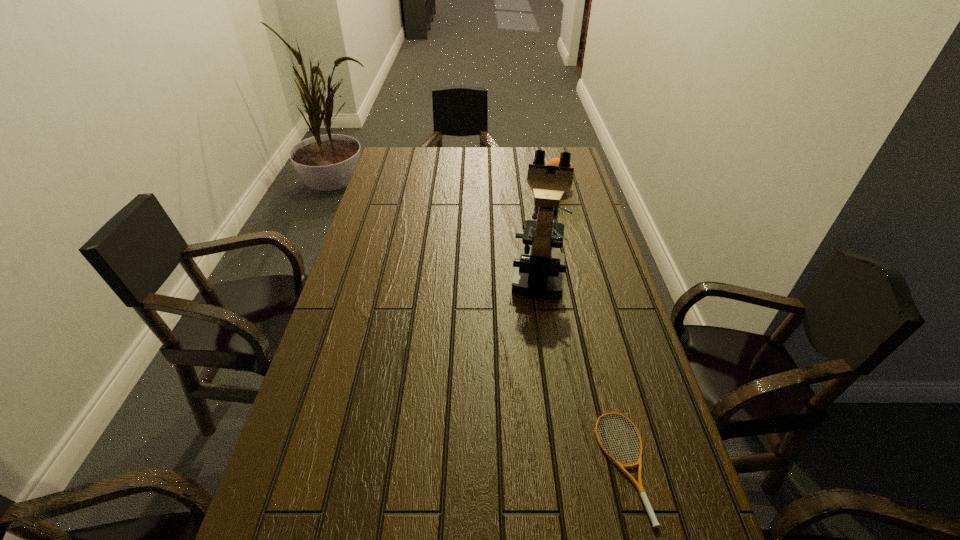
At what (x,y) coordinates should I click in order to perform the action: click on orange that is at the right edge. Please return your answer as a coordinate pair (x, y). Image resolution: width=960 pixels, height=540 pixels. Looking at the image, I should click on (555, 161).

At what (x,y) coordinates should I click in order to perform the action: click on tennis racket located at the right edge. Please return your answer as a coordinate pair (x, y). Looking at the image, I should click on (655, 523).

Where is `blank space at the left edge`? blank space at the left edge is located at coordinates (415, 191).

This screenshot has height=540, width=960. I want to click on vacant region at the right edge of the desktop, so click(x=633, y=402).

Where is `free space at the far left corner of the desktop`? This screenshot has height=540, width=960. free space at the far left corner of the desktop is located at coordinates (396, 170).

In the image, there is a desktop. Identify the location of free space at the far right corner. Image resolution: width=960 pixels, height=540 pixels. (575, 164).

The width and height of the screenshot is (960, 540). I want to click on free space that is in between the shortest object and the second farthest object, so click(x=581, y=369).

Locate an element on the screen. This screenshot has width=960, height=540. empty space that is in between the nearest object and the microscope is located at coordinates (581, 369).

Locate an element on the screen. The height and width of the screenshot is (540, 960). vacant area that lies between the nearest object and the microscope is located at coordinates (581, 369).

At what (x,y) coordinates should I click in order to perform the action: click on empty location between the nearest object and the farthest object. Please return your answer as a coordinate pair (x, y). Looking at the image, I should click on (590, 326).